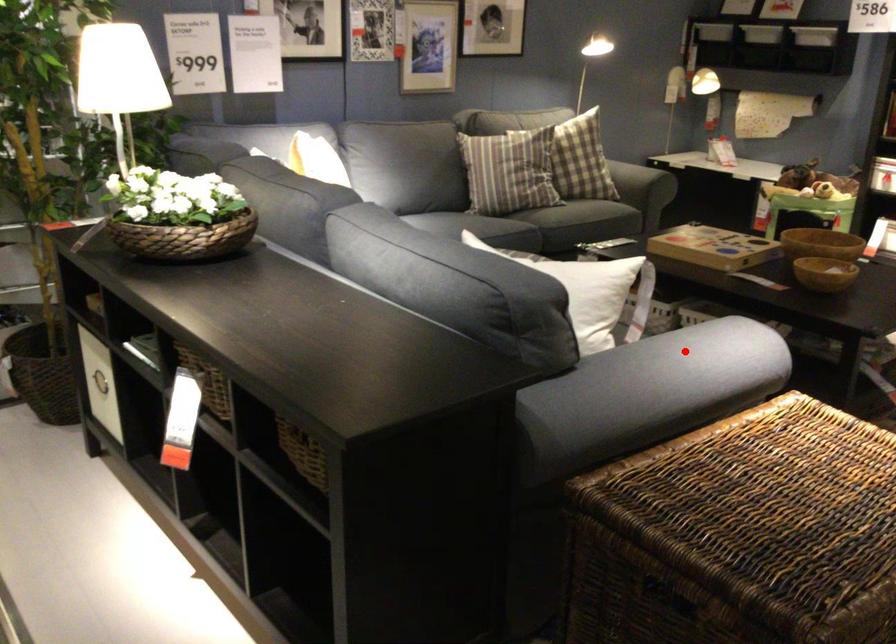
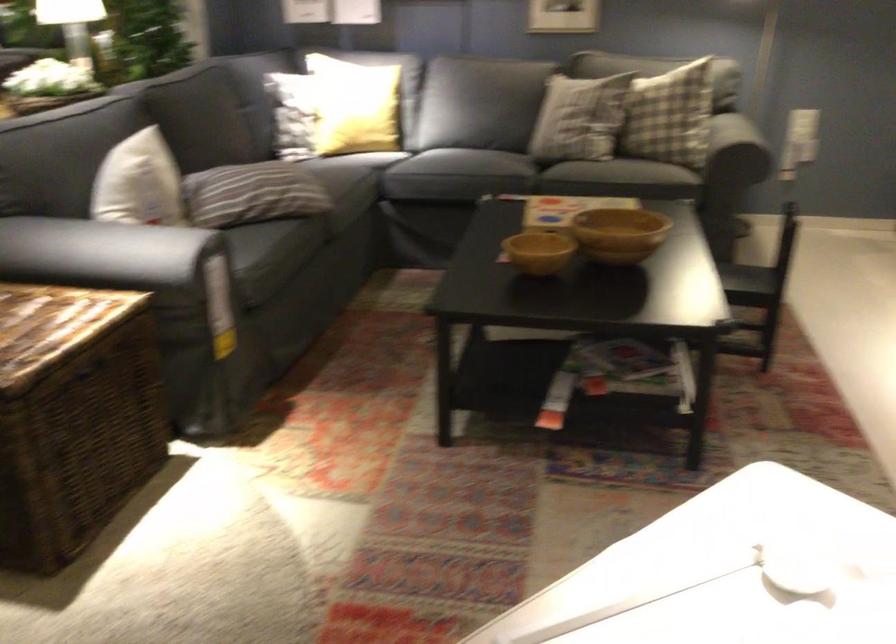
Locate, in the second image, the point that corresponds to the highlighted location in the first image.

(117, 252)